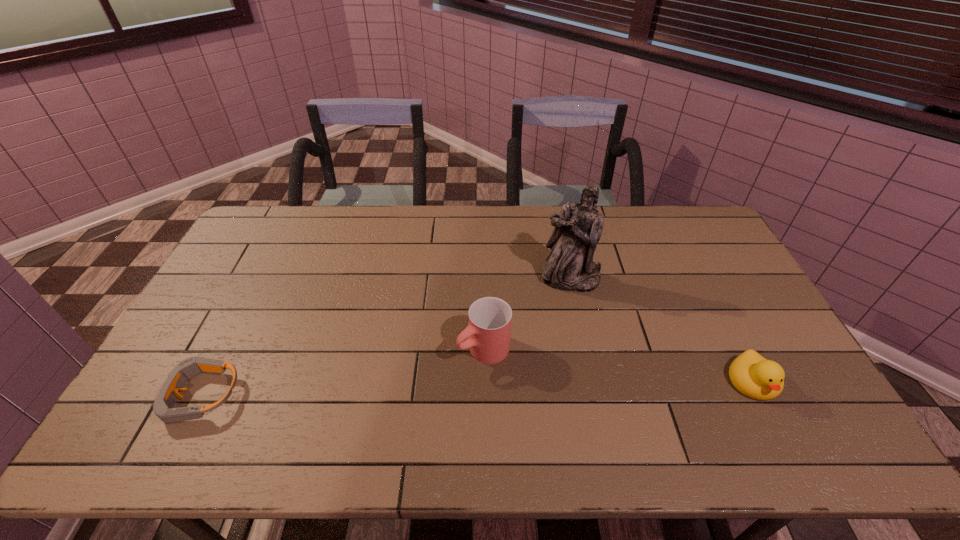
Where is `free space on the desktop that is between the shortest object and the duckling and is positioned on the front-facing side of the farthest object`? free space on the desktop that is between the shortest object and the duckling and is positioned on the front-facing side of the farthest object is located at coordinates (554, 387).

The width and height of the screenshot is (960, 540). Identify the location of free space on the desktop that is between the leftmost object and the second shortest object and is positioned on the side of the third object from right to left with the handle. (420, 390).